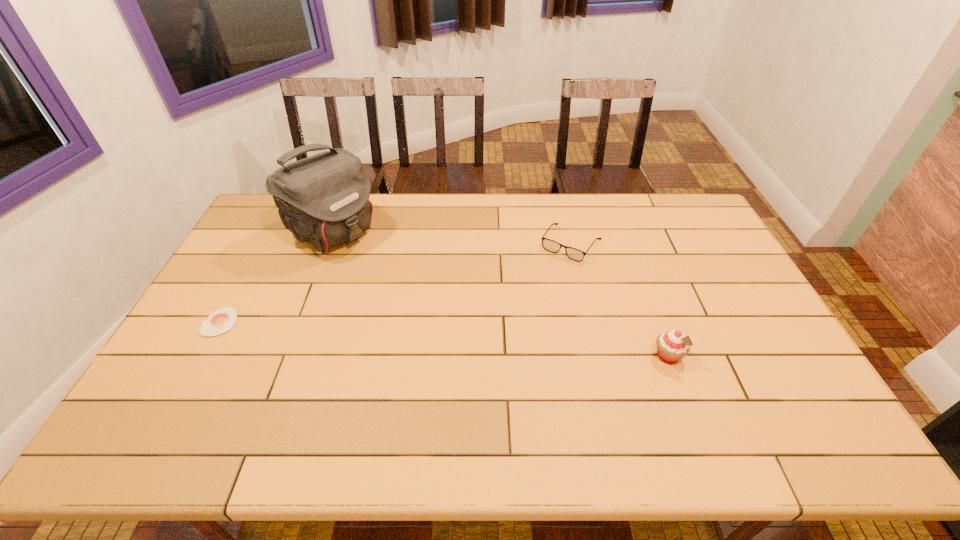
At what (x,y) coordinates should I click in order to perform the action: click on free location located on the open flap of the shoulder bag. Please return your answer as a coordinate pair (x, y). This screenshot has width=960, height=540. Looking at the image, I should click on (423, 300).

This screenshot has height=540, width=960. Identify the location of blank space located on the open flap of the shoulder bag. (437, 310).

The height and width of the screenshot is (540, 960). What are the coordinates of `vacant space located 0.380m on the open flap of the shoulder bag` in the screenshot? It's located at pos(437,310).

The height and width of the screenshot is (540, 960). What are the coordinates of `vacant space located 0.370m on the front-facing side of the second object from right to left` in the screenshot? It's located at (506, 338).

At what (x,y) coordinates should I click in order to perform the action: click on vacant space located on the front-facing side of the second object from right to left. Please return your answer as a coordinate pair (x, y). Looking at the image, I should click on (508, 335).

At what (x,y) coordinates should I click in order to perform the action: click on free space located 0.360m on the front-facing side of the second object from right to left. Please return your answer as a coordinate pair (x, y). The height and width of the screenshot is (540, 960). Looking at the image, I should click on (508, 335).

Locate an element on the screen. The height and width of the screenshot is (540, 960). shoulder bag that is positioned at the far edge is located at coordinates (323, 199).

Where is `spectacles that is positioned at the far edge`? spectacles that is positioned at the far edge is located at coordinates (549, 245).

You are a GUI agent. You are given a task and a screenshot of the screen. Output one action in this format:
    pyautogui.click(x=<x>, y=<y>)
    Task: Click on the egg yolk that is at the left edge
    The width and height of the screenshot is (960, 540).
    Given the screenshot: What is the action you would take?
    pyautogui.click(x=220, y=321)

Where is `shoulder bag present at the left edge`? shoulder bag present at the left edge is located at coordinates (323, 199).